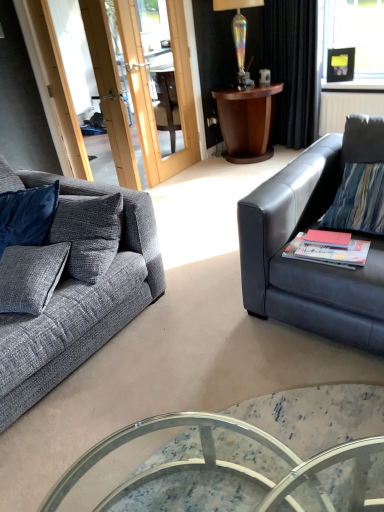
Question: Is iridescent glass lamp at upper center positioned far away from matte red book at right, acting as the second book starting from the right?

Choices:
 (A) no
 (B) yes

Answer: (B)

Question: Does iridescent glass lamp at upper center have a greater height compared to matte red book at right, acting as the second book starting from the right?

Choices:
 (A) no
 (B) yes

Answer: (B)

Question: From a real-world perspective, is iridescent glass lamp at upper center below matte red book at right, acting as the second book starting from the right?

Choices:
 (A) yes
 (B) no

Answer: (B)

Question: Does iridescent glass lamp at upper center touch matte red book at right, acting as the second book starting from the right?

Choices:
 (A) no
 (B) yes

Answer: (A)

Question: Is the depth of iridescent glass lamp at upper center less than that of matte red book at right, acting as the second book starting from the right?

Choices:
 (A) no
 (B) yes

Answer: (A)

Question: Considering the relative positions of matte white coffee cup at upper center and marble glass coffee table at center in the image provided, is matte white coffee cup at upper center to the left or to the right of marble glass coffee table at center?

Choices:
 (A) right
 (B) left

Answer: (A)

Question: Is point (269, 78) closer or farther from the camera than point (201, 458)?

Choices:
 (A) closer
 (B) farther

Answer: (B)

Question: Considering the positions of matte white coffee cup at upper center and marble glass coffee table at center in the image, is matte white coffee cup at upper center taller or shorter than marble glass coffee table at center?

Choices:
 (A) tall
 (B) short

Answer: (B)

Question: Based on their sizes in the image, would you say matte white coffee cup at upper center is bigger or smaller than marble glass coffee table at center?

Choices:
 (A) small
 (B) big

Answer: (A)

Question: In terms of size, does matte red book at right, which ranks as the 1th book in left-to-right order, appear bigger or smaller than black velvet curtain at upper right?

Choices:
 (A) small
 (B) big

Answer: (A)

Question: From a real-world perspective, is matte red book at right, which ranks as the 1th book in left-to-right order, positioned above or below black velvet curtain at upper right?

Choices:
 (A) above
 (B) below

Answer: (B)

Question: Is matte red book at right, acting as the second book starting from the right, taller or shorter than black velvet curtain at upper right?

Choices:
 (A) tall
 (B) short

Answer: (B)

Question: Is point (329, 253) closer or farther from the camera than point (292, 101)?

Choices:
 (A) closer
 (B) farther

Answer: (A)

Question: From a real-world perspective, is dark wood side table at upper center positioned above or below marble glass coffee table at center?

Choices:
 (A) above
 (B) below

Answer: (A)

Question: Considering the positions of dark wood side table at upper center and marble glass coffee table at center in the image, is dark wood side table at upper center bigger or smaller than marble glass coffee table at center?

Choices:
 (A) small
 (B) big

Answer: (B)